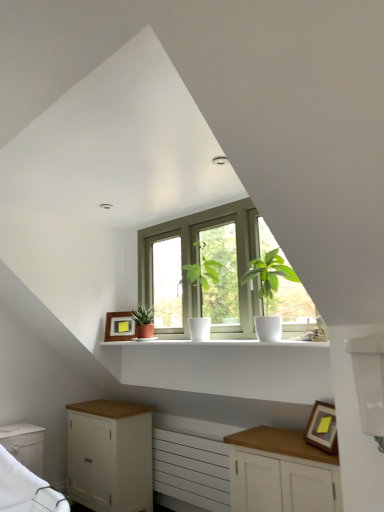
Question: Is green matte plant at center, marked as the 2th houseplant in a right-to-left arrangement, not inside white glossy shelf at center?

Choices:
 (A) no
 (B) yes

Answer: (B)

Question: Considering the relative sizes of green matte plant at center, which is the first houseplant in back-to-front order, and white glossy shelf at center in the image provided, is green matte plant at center, which is the first houseplant in back-to-front order, smaller than white glossy shelf at center?

Choices:
 (A) no
 (B) yes

Answer: (B)

Question: Can you confirm if green matte plant at center, placed as the 2th houseplant when sorted from front to back, is positioned to the right of white glossy shelf at center?

Choices:
 (A) yes
 (B) no

Answer: (B)

Question: Is green matte plant at center, placed as the 2th houseplant when sorted from front to back, positioned with its back to white glossy shelf at center?

Choices:
 (A) yes
 (B) no

Answer: (B)

Question: From the image's perspective, is green matte plant at center, placed as the 2th houseplant when sorted from front to back, above white glossy shelf at center?

Choices:
 (A) yes
 (B) no

Answer: (A)

Question: Is matte wooden picture frame at center, the 2th picture frame in the front-to-back sequence, to the left of wooden framed picture at lower right, which is counted as the first picture frame, starting from the front, from the viewer's perspective?

Choices:
 (A) no
 (B) yes

Answer: (B)

Question: Is matte wooden picture frame at center, which is the 1th picture frame in top-to-bottom order, far from wooden framed picture at lower right, the second picture frame viewed from the back?

Choices:
 (A) no
 (B) yes

Answer: (B)

Question: Considering the relative sizes of matte wooden picture frame at center, placed as the first picture frame when sorted from left to right, and wooden framed picture at lower right, which ranks as the 1th picture frame in right-to-left order, in the image provided, is matte wooden picture frame at center, placed as the first picture frame when sorted from left to right, bigger than wooden framed picture at lower right, which ranks as the 1th picture frame in right-to-left order,?

Choices:
 (A) yes
 (B) no

Answer: (A)

Question: Can you confirm if matte wooden picture frame at center, placed as the first picture frame when sorted from left to right, is smaller than wooden framed picture at lower right, acting as the 2th picture frame starting from the left?

Choices:
 (A) no
 (B) yes

Answer: (A)

Question: From the image's perspective, is matte wooden picture frame at center, the 2th picture frame in the front-to-back sequence, beneath wooden framed picture at lower right, acting as the 2th picture frame starting from the left?

Choices:
 (A) yes
 (B) no

Answer: (B)

Question: Is matte wooden picture frame at center, which is the 1th picture frame in top-to-bottom order, positioned with its back to wooden framed picture at lower right, the second picture frame viewed from the back?

Choices:
 (A) no
 (B) yes

Answer: (A)

Question: Is white glossy shelf at center behind white matte cabinet at lower left, which is the 1th cabinetry in left-to-right order?

Choices:
 (A) yes
 (B) no

Answer: (B)